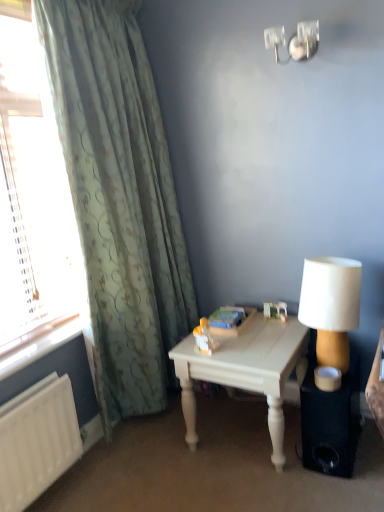
Identify the location of empty space that is ontop of white painted wood table at center (from a real-world perspective). (256, 334).